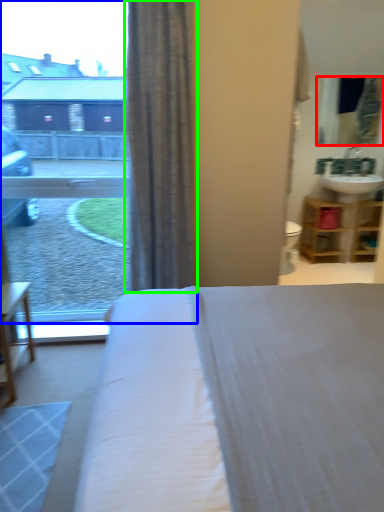
Question: Which object is the closest to the mirror (highlighted by a red box)? Choose among these: window (highlighted by a blue box) or curtain (highlighted by a green box).

Choices:
 (A) window
 (B) curtain

Answer: (B)